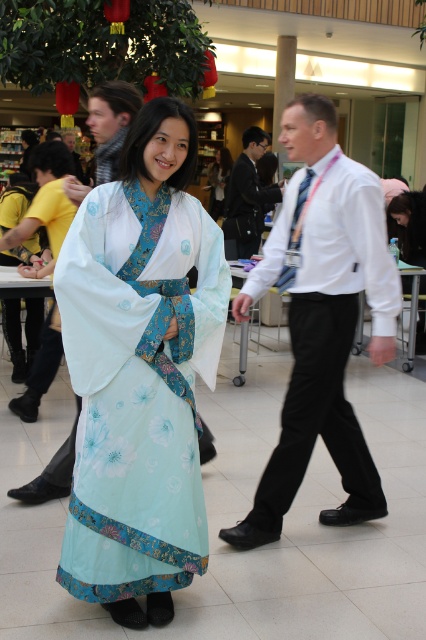
Question: Among these points, which one is nearest to the camera?

Choices:
 (A) (71, 132)
 (B) (183, 445)

Answer: (B)

Question: Considering the relative positions of white shirt at center and dark blue textured suit at center in the image provided, where is white shirt at center located with respect to dark blue textured suit at center?

Choices:
 (A) right
 (B) left

Answer: (A)

Question: Which object is positioned closest to the white shirt at center?

Choices:
 (A) matte black shirt at center
 (B) dark blue textured suit at center

Answer: (B)

Question: Is the position of dark blue textured suit at center more distant than that of matte black shirt at center?

Choices:
 (A) yes
 (B) no

Answer: (B)

Question: Is dark blue textured suit at center behind light blue floral kimono at center?

Choices:
 (A) yes
 (B) no

Answer: (B)

Question: Among these objects, which one is farthest from the camera?

Choices:
 (A) matte black shirt at center
 (B) matte black scarf at upper left
 (C) dark blue textured suit at center
 (D) white shirt at center

Answer: (A)